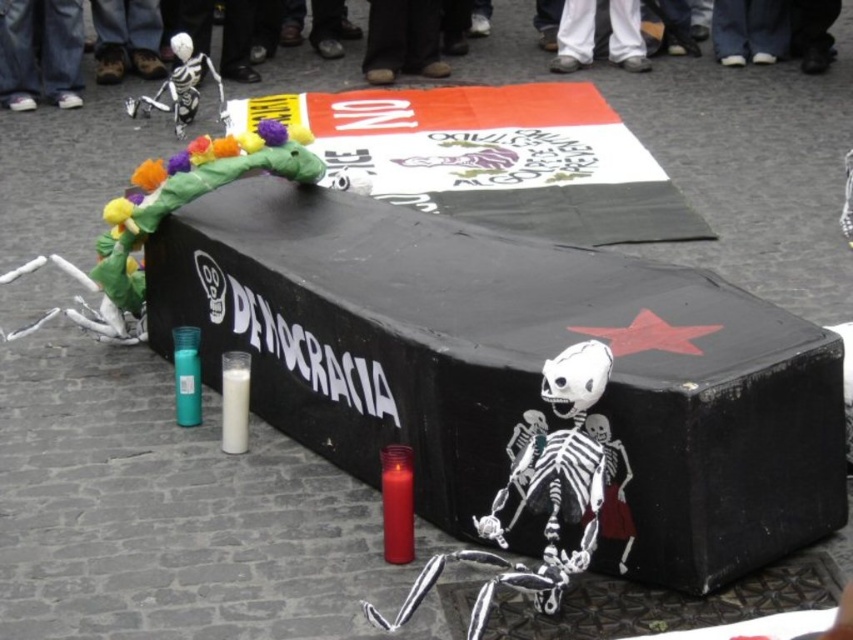
Can you confirm if brown leather shoes at upper left is taller than white pants at upper center?

Yes.

Is brown leather shoes at upper left shorter than white pants at upper center?

In fact, brown leather shoes at upper left may be taller than white pants at upper center.

Locate an element on the screen. This screenshot has height=640, width=853. brown leather shoes at upper left is located at coordinates (126, 38).

Based on the photo, does jeans at upper left have a greater width compared to white pants at upper center?

In fact, jeans at upper left might be narrower than white pants at upper center.

Does point (74, 13) come farther from viewer compared to point (619, 61)?

No, (74, 13) is closer to viewer.

Locate an element on the screen. jeans at upper left is located at coordinates (39, 52).

Who is taller, white plastic skeleton at upper center or brown leather shoes at upper left?

white plastic skeleton at upper center

You are a GUI agent. You are given a task and a screenshot of the screen. Output one action in this format:
    pyautogui.click(x=<x>, y=<y>)
    Task: Click on the white plastic skeleton at upper center
    Image resolution: width=853 pixels, height=640 pixels.
    Given the screenshot: What is the action you would take?
    pyautogui.click(x=728, y=81)